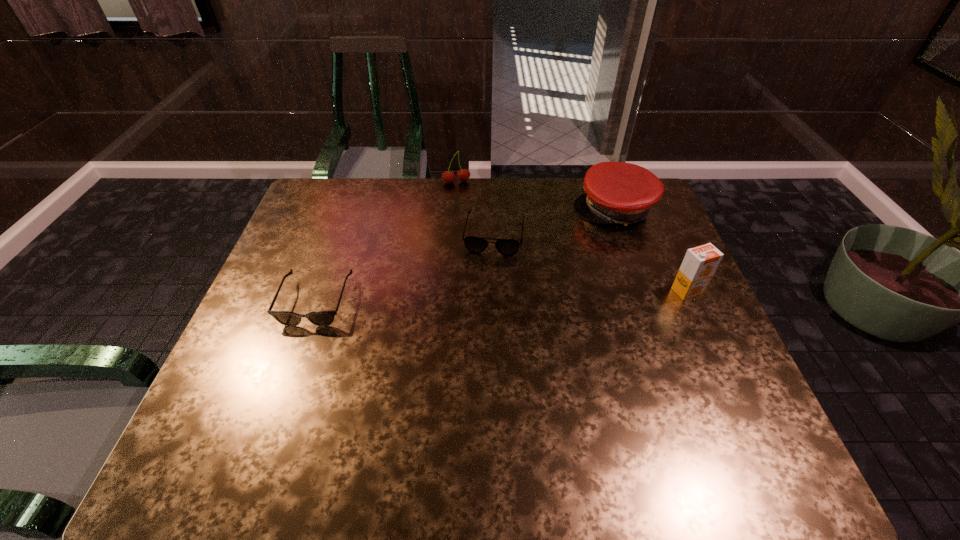
Locate which object ranks in proximity to the cherry. Please provide its 2D coordinates. Your answer should be formatted as a tuple, i.e. [(x, y)], where the tuple contains the x and y coordinates of a point satisfying the conditions above.

[(508, 247)]

At what (x,y) coordinates should I click in order to perform the action: click on free location that satisfies the following two spatial constraints: 1. on the front side of the orange juice; 2. on the right side of the cherry. Please return your answer as a coordinate pair (x, y). The height and width of the screenshot is (540, 960). Looking at the image, I should click on (449, 291).

Identify the location of vacant space that satisfies the following two spatial constraints: 1. on the front side of the spectacles; 2. on the right side of the farthest object. (453, 234).